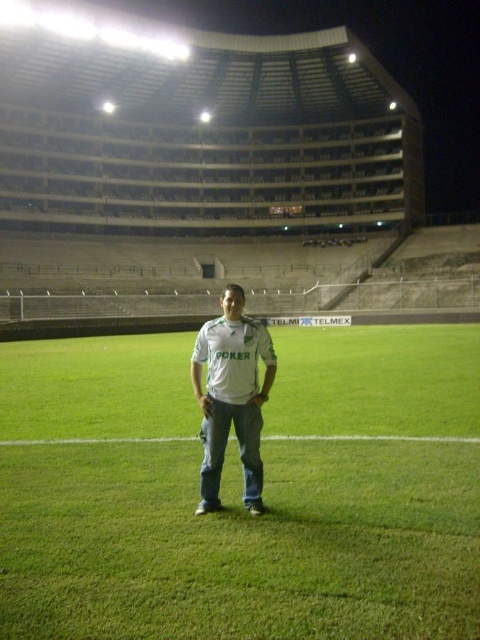
Describe the element at coordinates (240, 492) in the screenshot. This screenshot has width=480, height=640. I see `green grass at center` at that location.

Does green grass at center have a greater height compared to white matte shirt at center?

No.

Is point (456, 364) farther from camera compared to point (245, 449)?

Yes.

Image resolution: width=480 pixels, height=640 pixels. What are the coordinates of `green grass at center` in the screenshot? It's located at (240, 492).